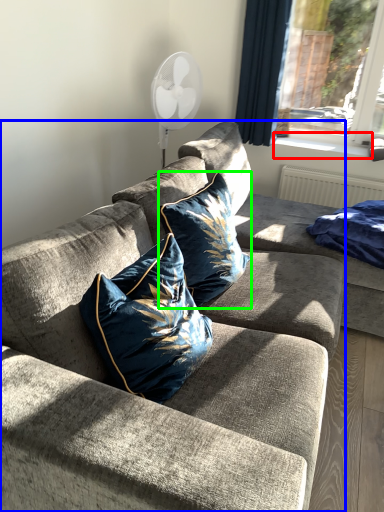
Question: Considering the real-world distances, which object is farthest from window sill (highlighted by a red box)? studio couch (highlighted by a blue box) or pillow (highlighted by a green box)?

Choices:
 (A) studio couch
 (B) pillow

Answer: (A)